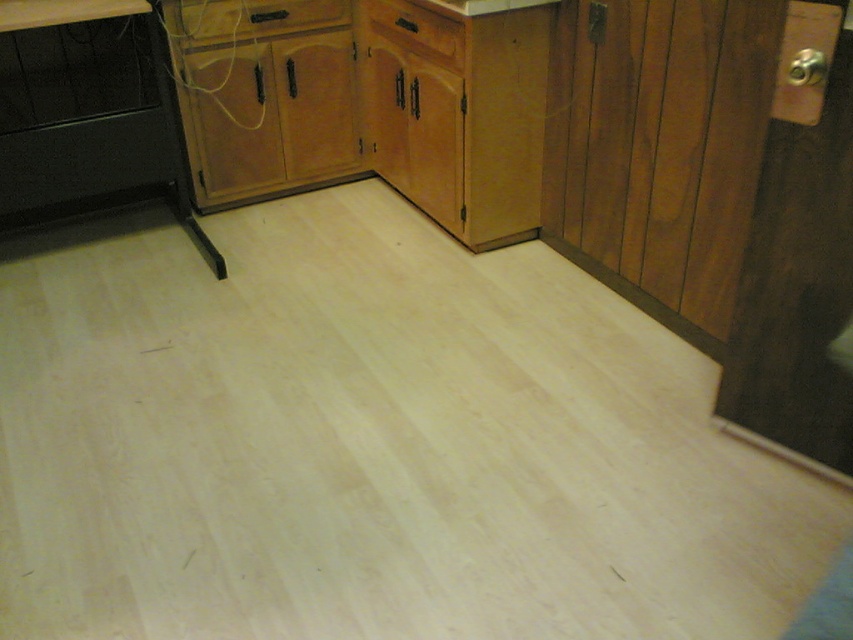
You are organizing a kitchen and need to place a new appliance that requires a surface wider than the wooden drawer at upper center. Is the white laminate counter top at upper left wide enough?

The wooden drawer at upper center is wider than the white laminate counter top at upper left, so the counter top is not wide enough to accommodate the appliance.

You are standing in the kitchen and want to reach the white laminate counter top at upper left. However, there is a black matte stove at left in your way. Can you walk around the stove to get to the counter?

The black matte stove at left is further to the viewer than the white laminate counter top at upper left, so you can walk around the stove to access the counter.